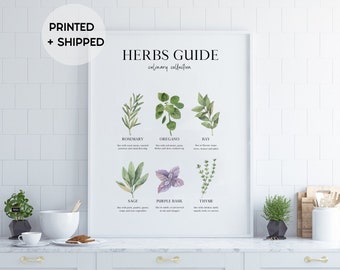
The image size is (340, 270). In order to click on teacup in this screenshot , I will do `click(29, 236)`.